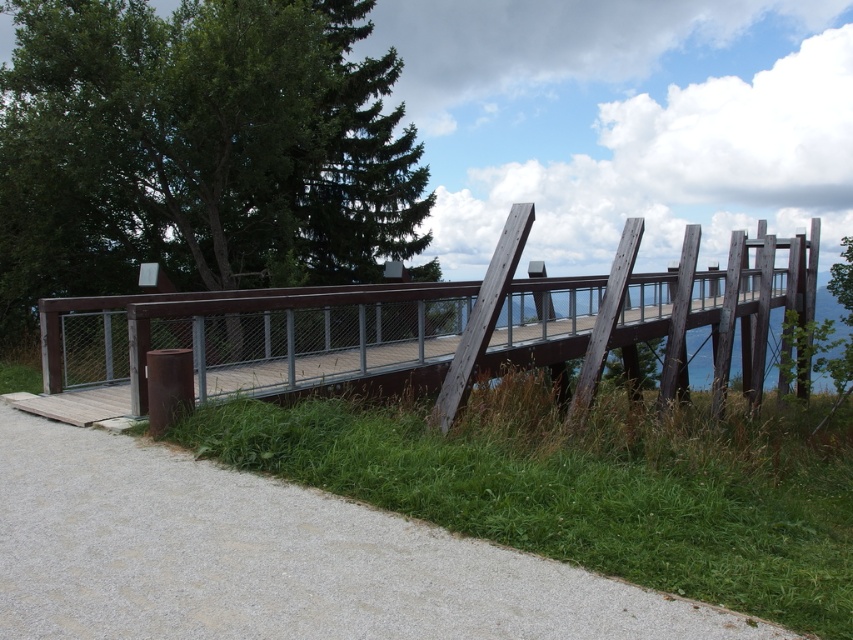
Looking at this image, which of these two, gravel at lower left or brown wooden bridge at center, stands shorter?

Standing shorter between the two is gravel at lower left.

Is gravel at lower left shorter than brown wooden bridge at center?

Indeed, gravel at lower left has a lesser height compared to brown wooden bridge at center.

Is point (666, 621) positioned behind point (257, 356)?

No, it is in front of (257, 356).

Locate an element on the screen. The image size is (853, 640). gravel at lower left is located at coordinates (273, 557).